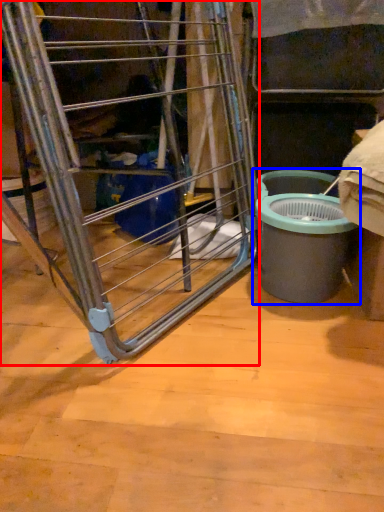
Question: Which object appears farthest to the camera in this image, ladder (highlighted by a red box) or waste container (highlighted by a blue box)?

Choices:
 (A) ladder
 (B) waste container

Answer: (B)